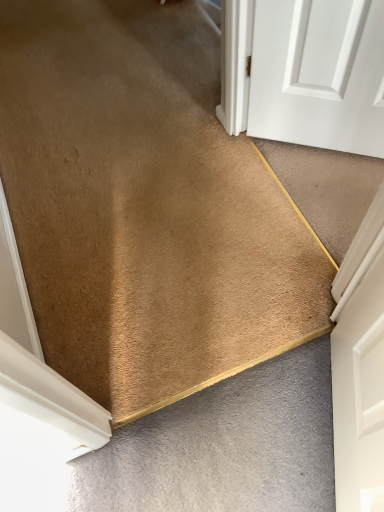
Describe the element at coordinates (224, 446) in the screenshot. I see `smooth gray carpet at lower center` at that location.

Identify the location of smooth gray carpet at lower center. The height and width of the screenshot is (512, 384). (224, 446).

In order to click on smooth gray carpet at lower center in this screenshot , I will do `click(224, 446)`.